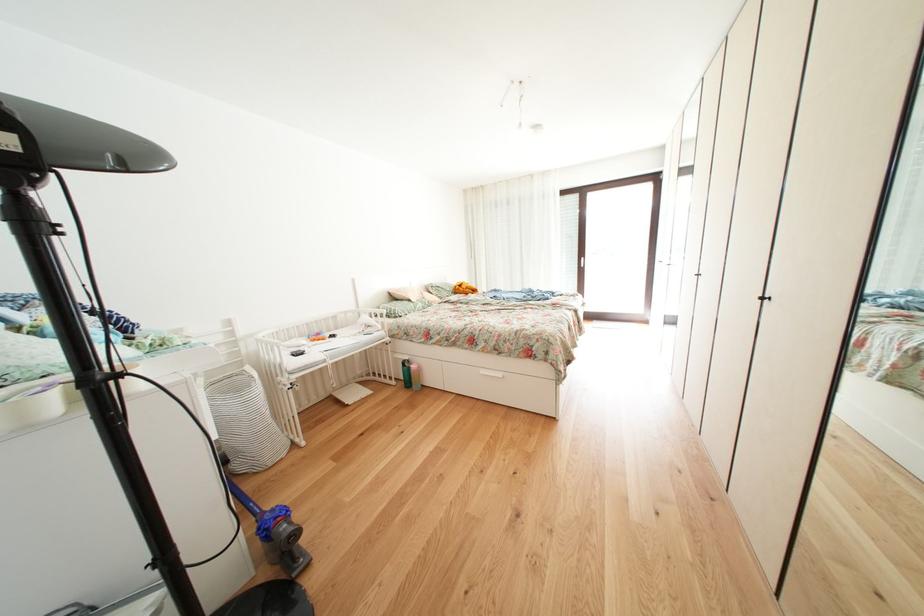
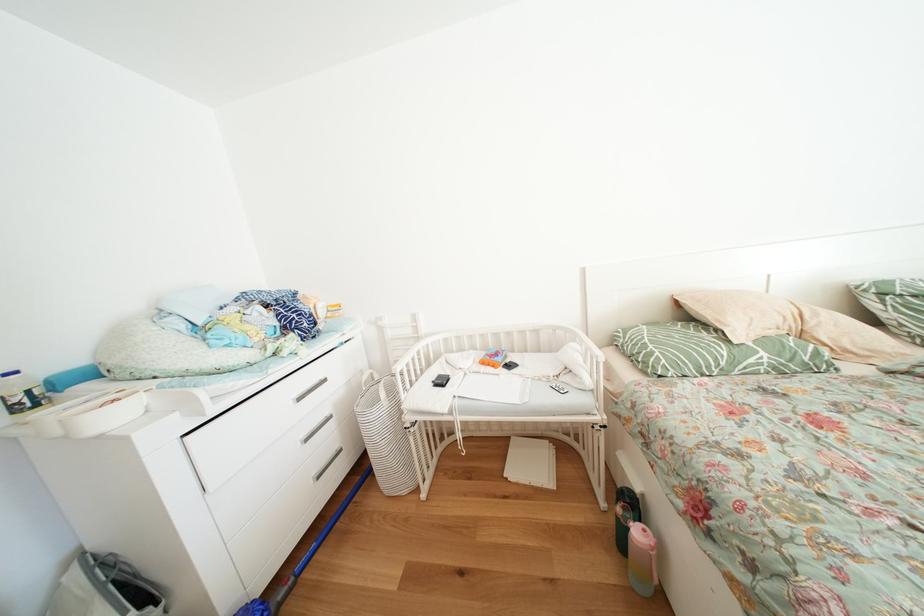
The point at (423, 371) is marked in the first image. Where is the corresponding point in the second image?

(648, 538)